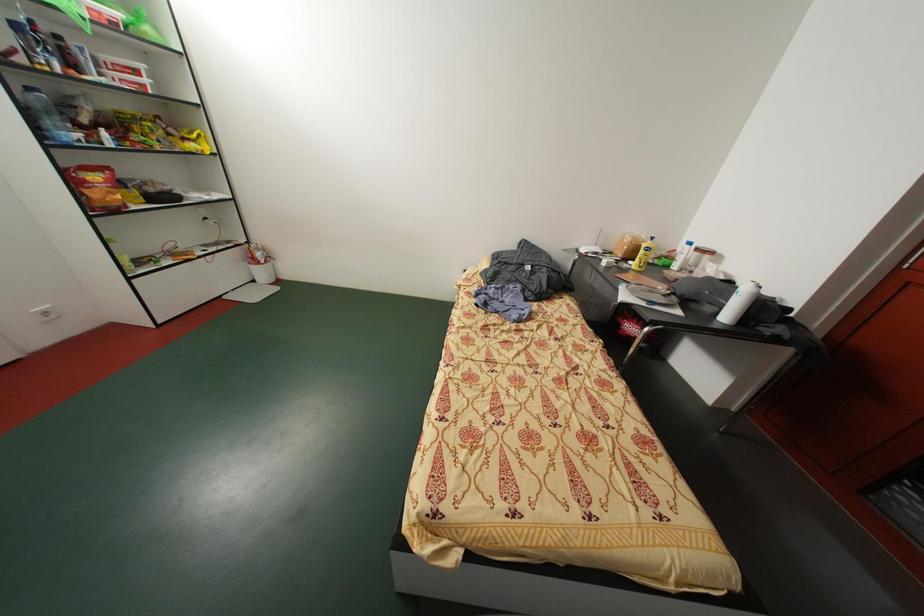
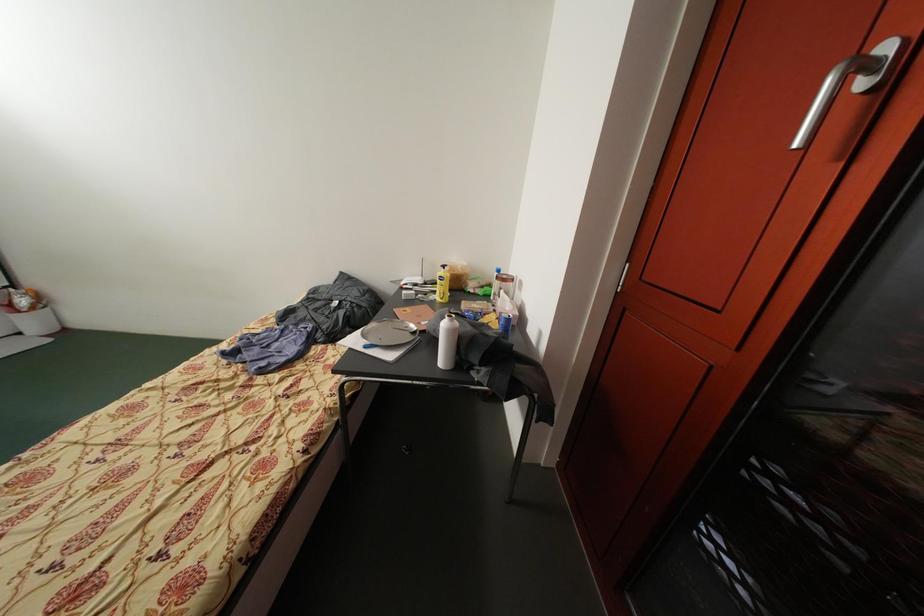
Question: Which direction would the cameraman need to move to produce the second image? Reply with the corresponding letter.

Choices:
 (A) Left
 (B) Right
 (C) Forward
 (D) Backward

Answer: (B)